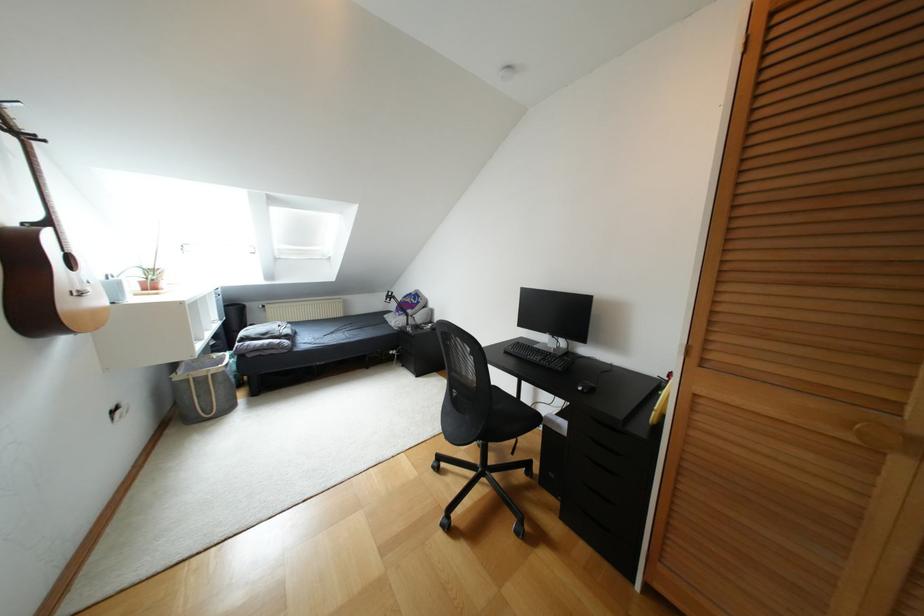
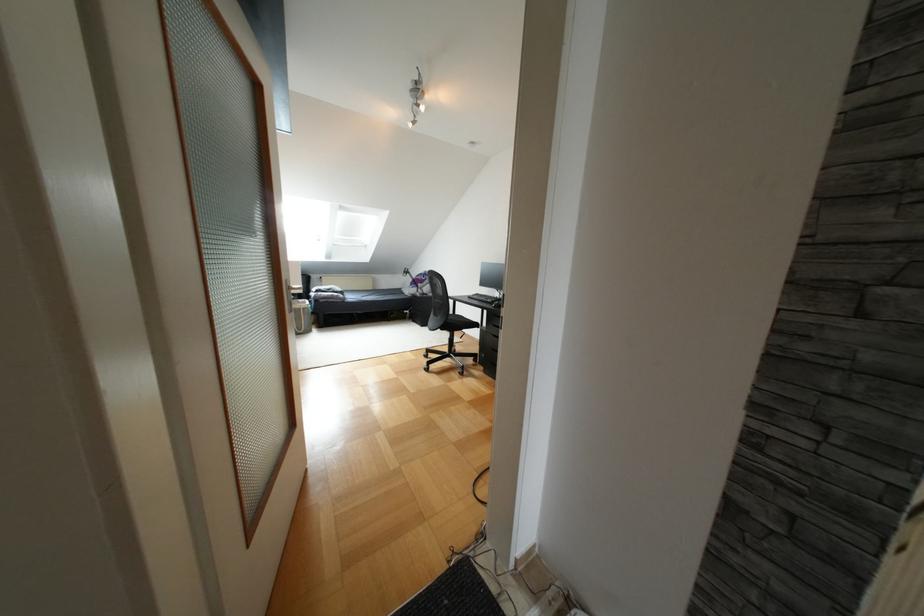
Where in the second image is the point corresponding to point (227, 408) from the first image?

(309, 330)